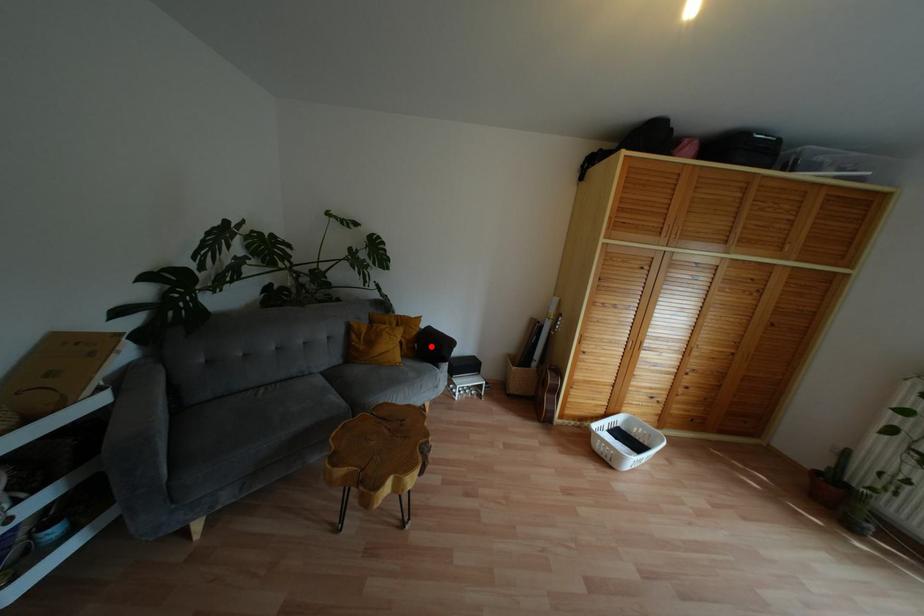
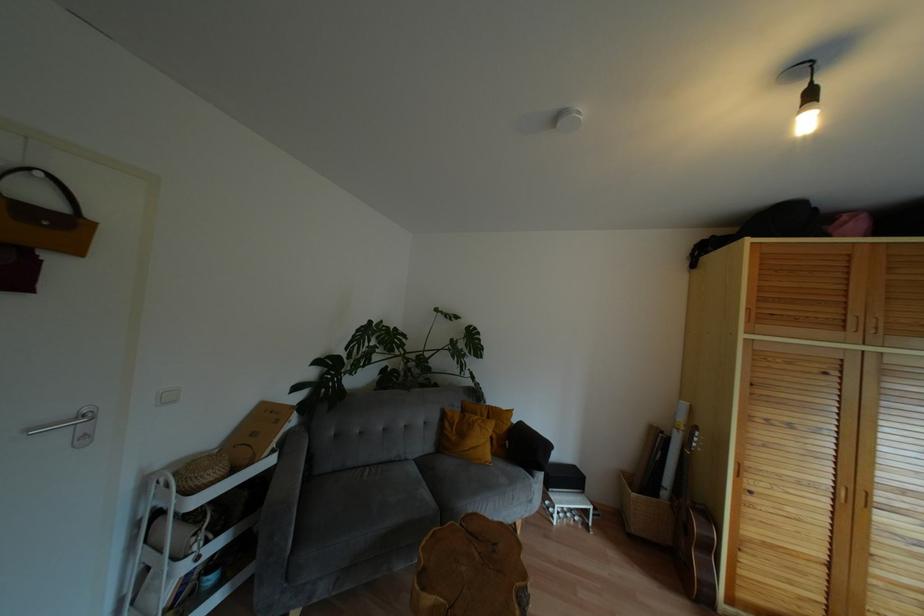
The point at the highlighted location is marked in the first image. Where is the corresponding point in the second image?

(524, 448)